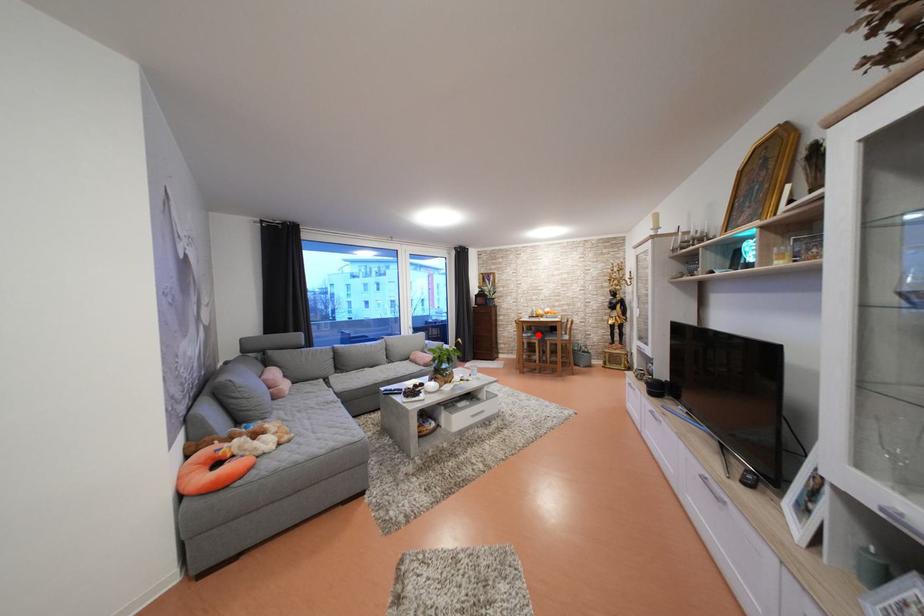
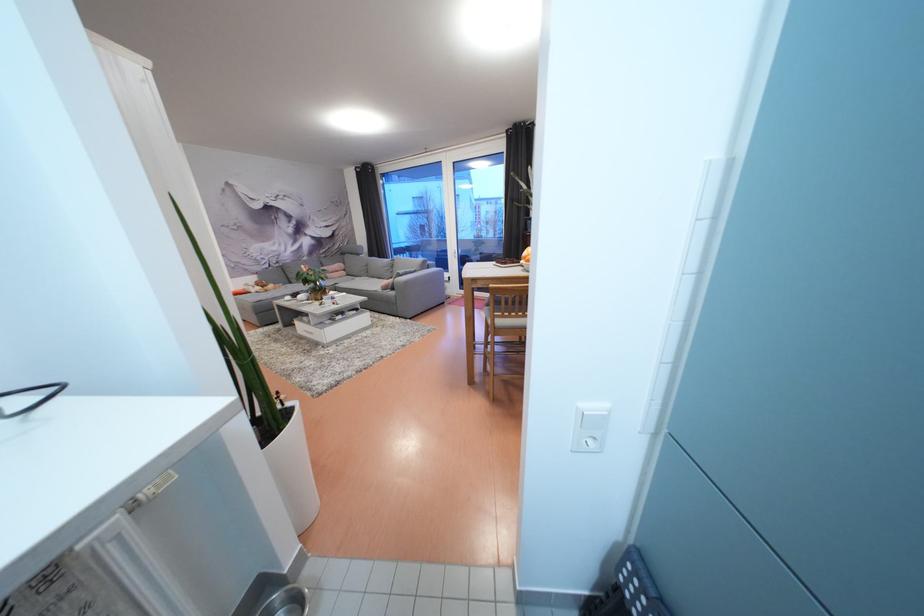
Question: I am providing you with two images of the same scene from different viewpoints. A red point is marked on the first image. Can you still see the location of the red point in image 2?

Choices:
 (A) Yes
 (B) No

Answer: (B)